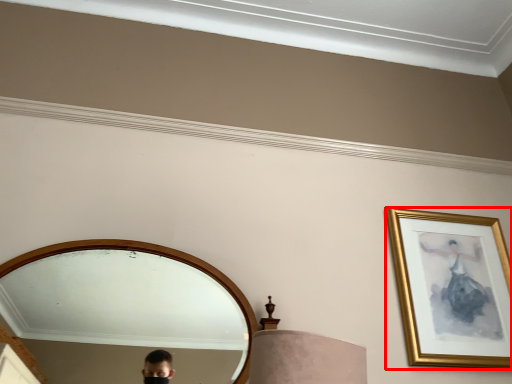
Question: Where is picture frame (annotated by the red box) located in relation to mirror in the image?

Choices:
 (A) left
 (B) right

Answer: (B)